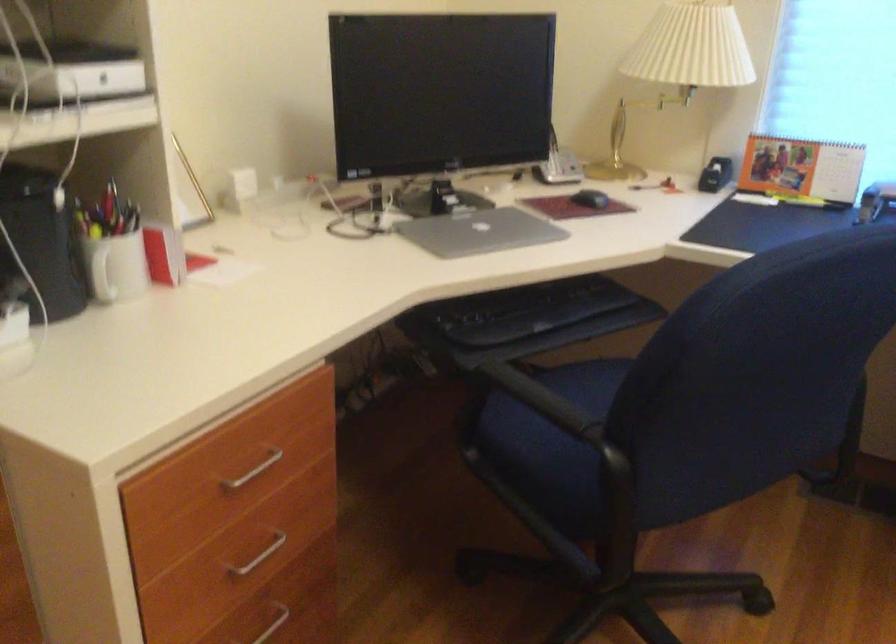
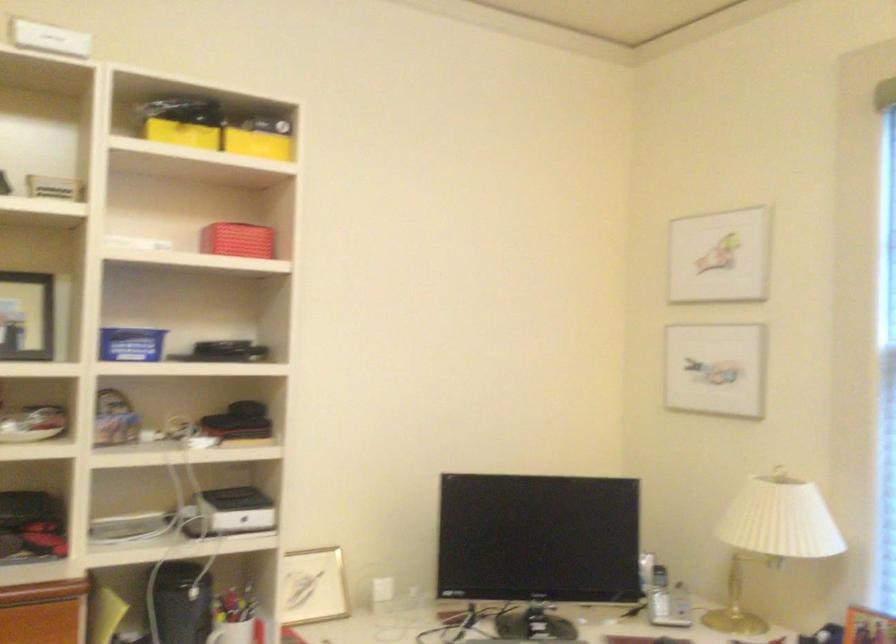
Where in the second image is the point corresponding to (110,249) from the first image?

(231, 632)